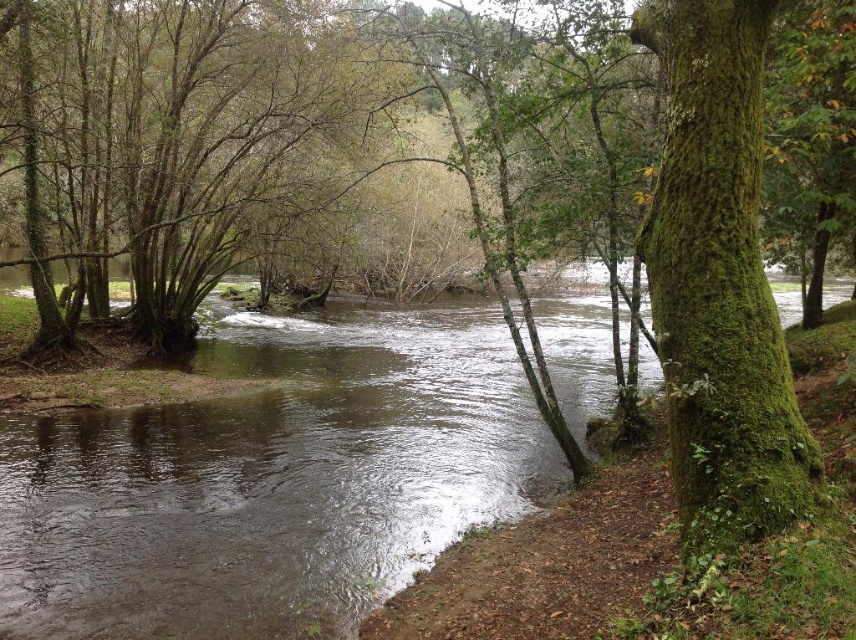
Can you confirm if clear water at center is positioned below green mossy tree at right?

Actually, clear water at center is above green mossy tree at right.

Can you confirm if clear water at center is smaller than green mossy tree at right?

No.

Is point (456, 349) behind point (678, 244)?

Yes, point (456, 349) is farther from viewer.

The height and width of the screenshot is (640, 856). What are the coordinates of `clear water at center` in the screenshot? It's located at (272, 481).